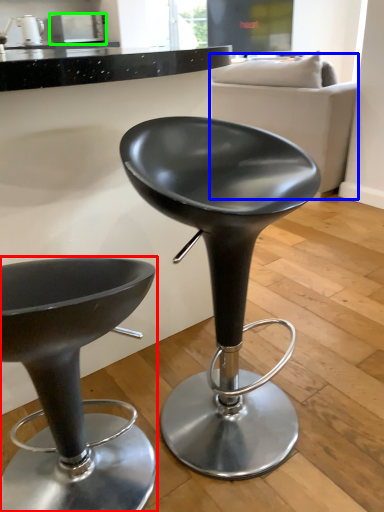
Question: Based on their relative distances, which object is nearer to chair (highlighted by a red box)? Choose from couch (highlighted by a blue box) and appliance (highlighted by a green box).

Choices:
 (A) couch
 (B) appliance

Answer: (A)